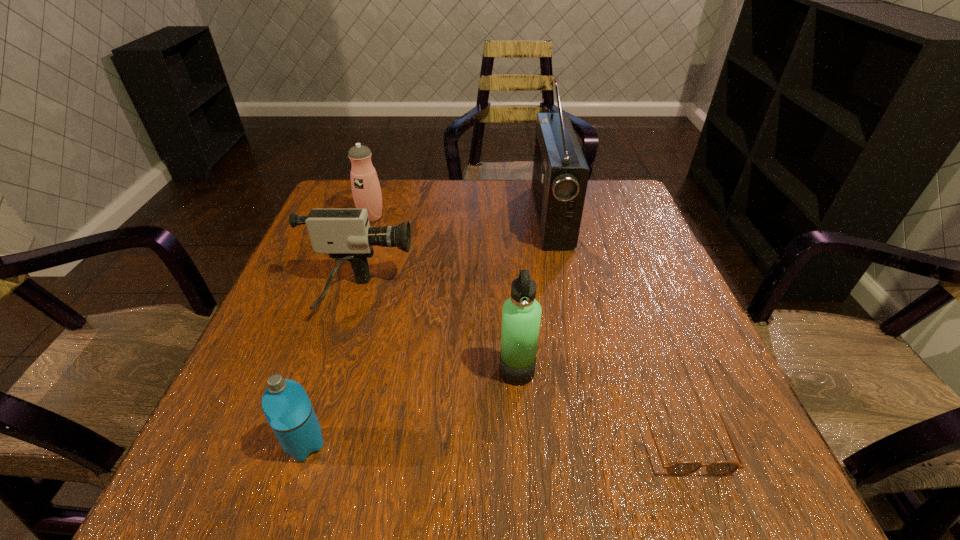
Identify the location of vacant space at the far right corner of the desktop. This screenshot has height=540, width=960. (584, 223).

The width and height of the screenshot is (960, 540). I want to click on vacant area that lies between the camcorder and the second nearest thermos bottle, so click(x=438, y=334).

Identify the location of free space between the rightmost object and the second object from right to left. The image size is (960, 540). (617, 328).

The image size is (960, 540). Find the location of `free space between the radio receiver and the farthest thermos bottle`. free space between the radio receiver and the farthest thermos bottle is located at coordinates (462, 217).

Identify the location of free area in between the fourth farthest object and the farthest thermos bottle. Image resolution: width=960 pixels, height=540 pixels. (444, 294).

Image resolution: width=960 pixels, height=540 pixels. Find the location of `free point between the nearest thermos bottle and the farthest thermos bottle`. free point between the nearest thermos bottle and the farthest thermos bottle is located at coordinates (339, 331).

Image resolution: width=960 pixels, height=540 pixels. I want to click on empty location between the rightmost object and the second object from right to left, so click(617, 328).

Identify the location of object identified as the closest to the shortest thermos bottle. The image size is (960, 540). (345, 234).

Find the location of a particular element. Image resolution: width=960 pixels, height=540 pixels. object identified as the second closest to the sunglasses is located at coordinates (560, 175).

Choose which thermos bottle is the nearest neighbor to the camcorder. Please provide its 2D coordinates. Your answer should be formatted as a tuple, i.e. [(x, y)], where the tuple contains the x and y coordinates of a point satisfying the conditions above.

[(366, 190)]